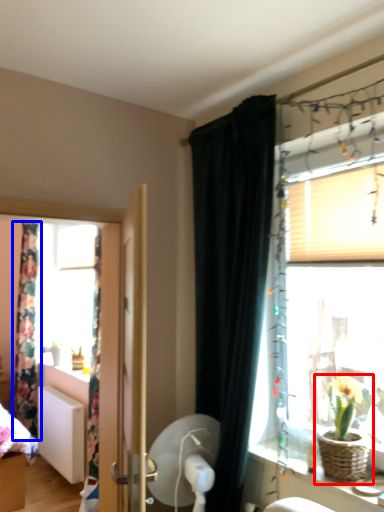
Question: Which of the following is the closest to the observer, houseplant (highlighted by a red box) or curtain (highlighted by a blue box)?

Choices:
 (A) houseplant
 (B) curtain

Answer: (A)